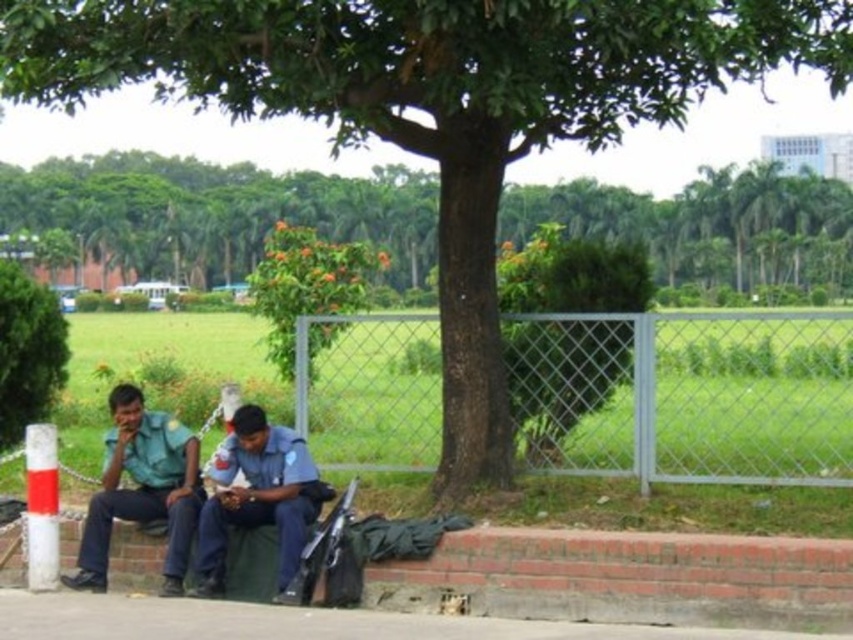
Is point (837, 408) positioned behind point (419, 246)?

No, (837, 408) is closer to viewer.

Between point (595, 358) and point (186, 179), which one is positioned behind?

Positioned behind is point (186, 179).

Identify the location of metallic chain-link fence at center. (701, 396).

Between brick at lower left and green uniform at left, which one is positioned lower?

brick at lower left is lower down.

Between point (767, 588) and point (195, 451), which one is positioned behind?

Positioned behind is point (195, 451).

Describe the element at coordinates (625, 579) in the screenshot. I see `brick at lower left` at that location.

What are the coordinates of `brick at lower left` in the screenshot? It's located at (625, 579).

Who is positioned more to the right, green leafy tree at upper center or blue uniform at center?

From the viewer's perspective, blue uniform at center appears more on the right side.

Is point (410, 241) closer to viewer compared to point (207, 536)?

That is False.

Is point (422, 280) behind point (312, 513)?

Yes, point (422, 280) is behind point (312, 513).

I want to click on green leafy tree at upper center, so click(x=218, y=211).